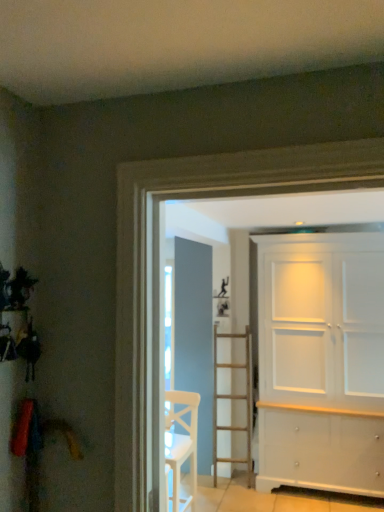
Question: From the image's perspective, is white painted wood cabinet at right located above white wooden chair at center?

Choices:
 (A) no
 (B) yes

Answer: (B)

Question: Does white painted wood cabinet at right have a lesser width compared to white wooden chair at center?

Choices:
 (A) yes
 (B) no

Answer: (B)

Question: Is white painted wood cabinet at right far from white wooden chair at center?

Choices:
 (A) yes
 (B) no

Answer: (A)

Question: Is white painted wood cabinet at right to the left of white wooden chair at center from the viewer's perspective?

Choices:
 (A) no
 (B) yes

Answer: (A)

Question: Does white painted wood cabinet at right have a smaller size compared to white wooden chair at center?

Choices:
 (A) yes
 (B) no

Answer: (B)

Question: From a real-world perspective, is white painted wood cabinet at right located beneath white wooden chair at center?

Choices:
 (A) yes
 (B) no

Answer: (B)

Question: Can you confirm if white wooden chair at center is thinner than white painted wood cabinet at right?

Choices:
 (A) yes
 (B) no

Answer: (A)

Question: Is the depth of white wooden chair at center greater than that of white painted wood cabinet at right?

Choices:
 (A) no
 (B) yes

Answer: (A)

Question: Is white wooden chair at center to the left of white painted wood cabinet at right from the viewer's perspective?

Choices:
 (A) no
 (B) yes

Answer: (B)

Question: Can you confirm if white wooden chair at center is positioned to the right of white painted wood cabinet at right?

Choices:
 (A) yes
 (B) no

Answer: (B)

Question: Is white wooden chair at center turned away from white painted wood cabinet at right?

Choices:
 (A) yes
 (B) no

Answer: (B)

Question: Can you confirm if white wooden chair at center is smaller than white painted wood cabinet at right?

Choices:
 (A) no
 (B) yes

Answer: (B)

Question: In terms of size, does white wooden chair at center appear bigger or smaller than white painted wood cabinet at right?

Choices:
 (A) small
 (B) big

Answer: (A)